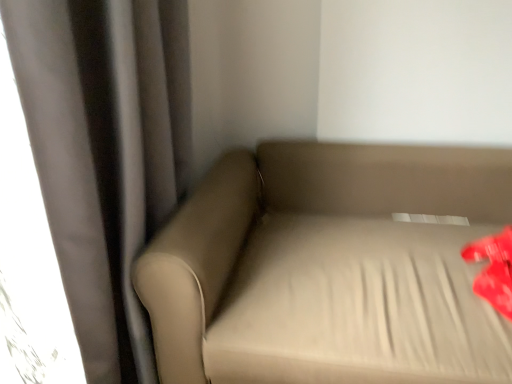
Find the location of a particular element. This screenshot has width=512, height=384. beige fabric couch at center is located at coordinates (330, 268).

The height and width of the screenshot is (384, 512). Describe the element at coordinates (330, 268) in the screenshot. I see `beige fabric couch at center` at that location.

This screenshot has height=384, width=512. I want to click on beige fabric couch at center, so click(330, 268).